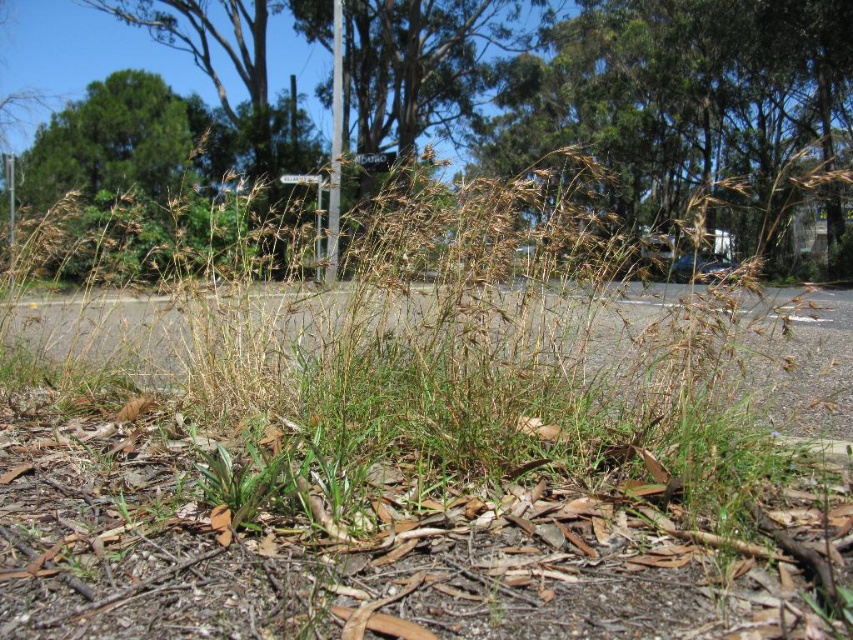
Does brown grass at upper center appear over metallic pole at center?

Indeed, brown grass at upper center is positioned over metallic pole at center.

Does brown grass at upper center appear under metallic pole at center?

Actually, brown grass at upper center is above metallic pole at center.

Who is more distant from viewer, (x=592, y=88) or (x=337, y=186)?

The point (x=592, y=88) is more distant.

Locate an element on the screen. This screenshot has width=853, height=640. brown grass at upper center is located at coordinates (683, 100).

Identify the location of metallic silver street sign at upper center. (375, 160).

Who is more distant from viewer, (387, 154) or (293, 177)?

The point (387, 154) is more distant.

At what (x,y) coordinates should I click in order to perform the action: click on metallic silver street sign at upper center. Please return your answer as a coordinate pair (x, y). This screenshot has width=853, height=640. Looking at the image, I should click on (375, 160).

Does green leafy tree at upper center have a smaller size compared to white plastic sign at center?

No, green leafy tree at upper center is not smaller than white plastic sign at center.

Looking at this image, between green leafy tree at upper center and white plastic sign at center, which one appears on the right side from the viewer's perspective?

green leafy tree at upper center is more to the right.

Who is more forward, (x=573, y=115) or (x=283, y=180)?

Positioned in front is point (x=283, y=180).

This screenshot has height=640, width=853. What are the coordinates of `green leafy tree at upper center` in the screenshot? It's located at pyautogui.click(x=616, y=93).